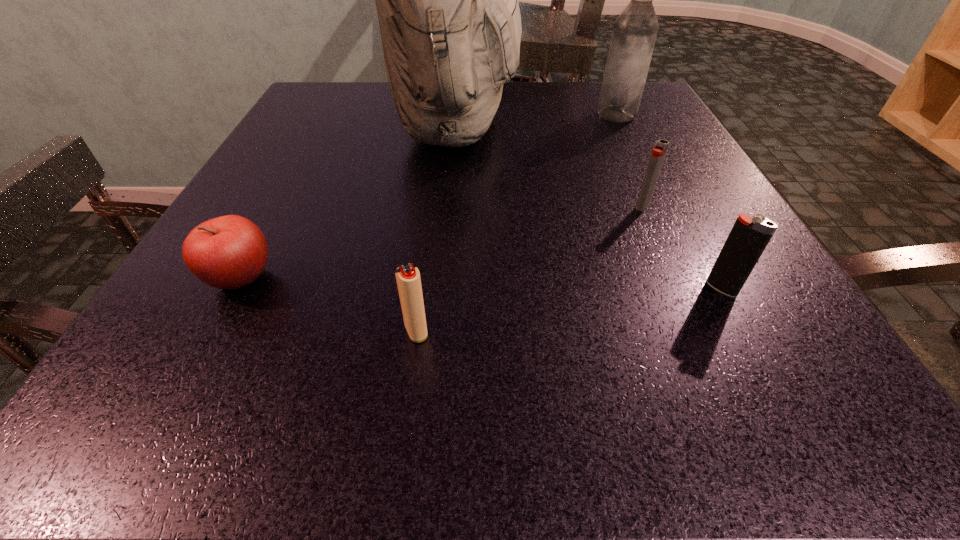
Identify the location of backpack. (447, 0).

Locate an element on the screen. This screenshot has height=540, width=960. the fifth shortest object is located at coordinates (635, 30).

Image resolution: width=960 pixels, height=540 pixels. I want to click on the rightmost igniter, so click(749, 236).

The image size is (960, 540). Find the location of `the third farthest object`. the third farthest object is located at coordinates (659, 151).

Locate an element on the screen. Image resolution: width=960 pixels, height=540 pixels. the farthest igniter is located at coordinates (659, 151).

You are a GUI agent. You are given a task and a screenshot of the screen. Output one action in this format:
    pyautogui.click(x=<x>, y=<y>)
    Task: Click on the leftmost igniter
    The image size is (960, 540).
    Given the screenshot: What is the action you would take?
    pyautogui.click(x=408, y=279)

This screenshot has height=540, width=960. What are the coordinates of `the nearest object` in the screenshot? It's located at (408, 279).

This screenshot has width=960, height=540. In order to click on the leftmost object in this screenshot , I will do `click(229, 252)`.

Image resolution: width=960 pixels, height=540 pixels. Identify the location of vacant space located on the front-facing side of the tallest object. (660, 125).

Locate an element on the screen. This screenshot has width=960, height=540. blank space located on the front of the fifth shortest object is located at coordinates (647, 177).